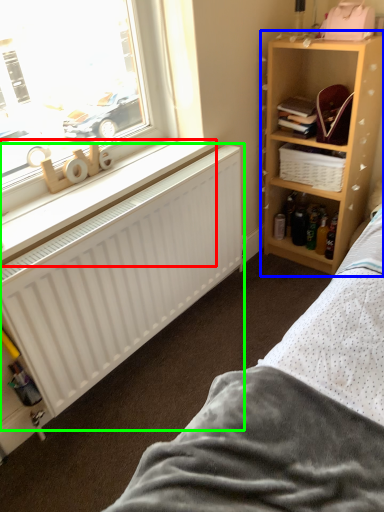
Question: Estimate the real-world distances between objects in this image. Which object is closer to window sill (highlighted by a red box), shelf (highlighted by a blue box) or radiator (highlighted by a green box)?

Choices:
 (A) shelf
 (B) radiator

Answer: (B)